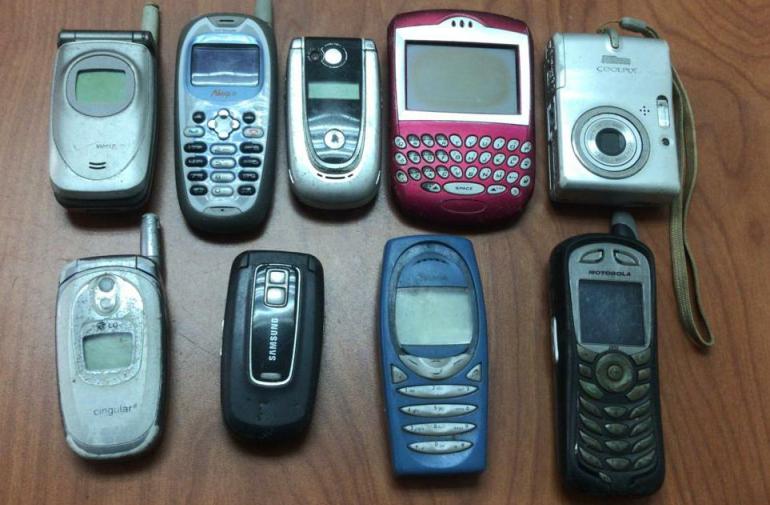
Where is `phone screen`? This screenshot has width=770, height=505. phone screen is located at coordinates 617,319, 434,314, 106,345, 102,88, 222,71, 329,91, 463,73.